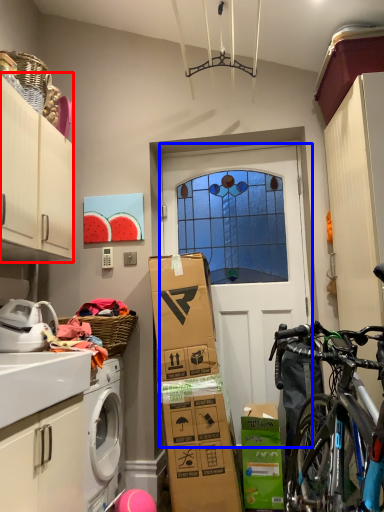
Question: Which point is further to the camera, cabinetry (highlighted by a red box) or door (highlighted by a blue box)?

Choices:
 (A) cabinetry
 (B) door

Answer: (B)